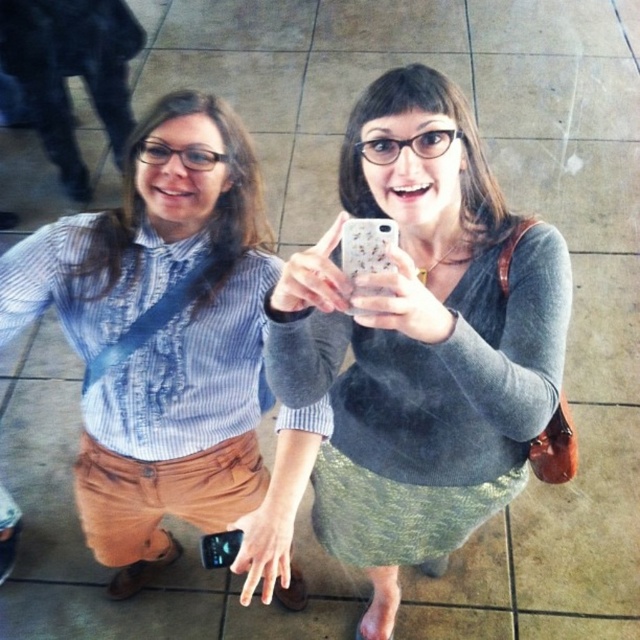
You are a fashion designer observing two people in the image. You need to decide which garment to recommend for a tall client. Both the gray wool sweater at center and the blue striped shirt at center are options. Which one would you suggest?

The gray wool sweater at center is much taller than the blue striped shirt at center, so it would be a better recommendation for a tall client as it provides a more elongated silhouette.

Looking at this image, you are a fashion stylist observing two people in the image. Both are wearing a gray wool sweater at center and a blue striped shirt at center. Which clothing item is located to the right of the other?

The gray wool sweater at center is positioned on the right side of the blue striped shirt at center.

You are a fashion designer observing two people at an event. You notice the gray wool sweater at center and the blue striped shirt at center. Which clothing item has a narrower width?

The gray wool sweater at center has a narrower width than the blue striped shirt at center according to the description.